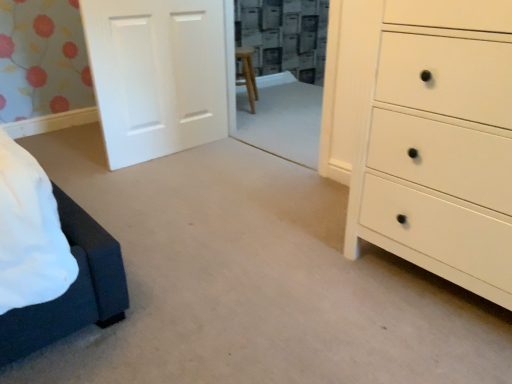
Question: Is white matte door at upper left in front of or behind white matte chest of drawers at right in the image?

Choices:
 (A) behind
 (B) front

Answer: (A)

Question: Choose the correct answer: Is white matte door at upper left inside white matte chest of drawers at right or outside it?

Choices:
 (A) inside
 (B) outside

Answer: (B)

Question: Considering the positions of point (212, 67) and point (437, 82), is point (212, 67) closer or farther from the camera than point (437, 82)?

Choices:
 (A) farther
 (B) closer

Answer: (A)

Question: From a real-world perspective, is white matte chest of drawers at right physically located above or below white matte door at upper left?

Choices:
 (A) above
 (B) below

Answer: (A)

Question: From their relative heights in the image, would you say white matte chest of drawers at right is taller or shorter than white matte door at upper left?

Choices:
 (A) tall
 (B) short

Answer: (A)

Question: From the image's perspective, is white matte chest of drawers at right above or below white matte door at upper left?

Choices:
 (A) above
 (B) below

Answer: (B)

Question: Is white matte chest of drawers at right in front of or behind white matte door at upper left in the image?

Choices:
 (A) behind
 (B) front

Answer: (B)